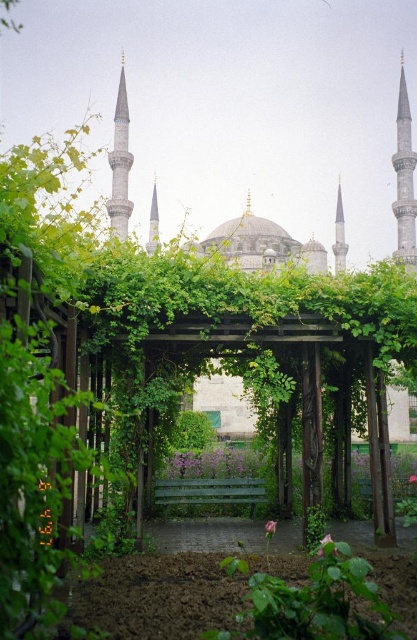
Is pink petal at center wider than pink fabric flower at center?

No, pink petal at center is not wider than pink fabric flower at center.

Between point (271, 528) and point (411, 483), which one is positioned behind?

The point (411, 483) is behind.

The image size is (417, 640). In order to click on pink petal at center in this screenshot , I will do `click(269, 528)`.

Which is more to the right, pink matte rose at center or pink petal at center?

pink matte rose at center

Who is more distant from viewer, (319, 554) or (268, 520)?

The point (268, 520) is more distant.

Who is more distant from viewer, [323,541] or [273,524]?

The point [323,541] is behind.

Where is `pink matte rose at center`? pink matte rose at center is located at coordinates (324, 544).

Is pink matte rose at center bigger than pink fabric flower at center?

Indeed, pink matte rose at center has a larger size compared to pink fabric flower at center.

Locate an element on the screen. pink matte rose at center is located at coordinates (324, 544).

This screenshot has height=640, width=417. What do you see at coordinates (324, 544) in the screenshot?
I see `pink matte rose at center` at bounding box center [324, 544].

I want to click on pink matte rose at center, so click(x=324, y=544).